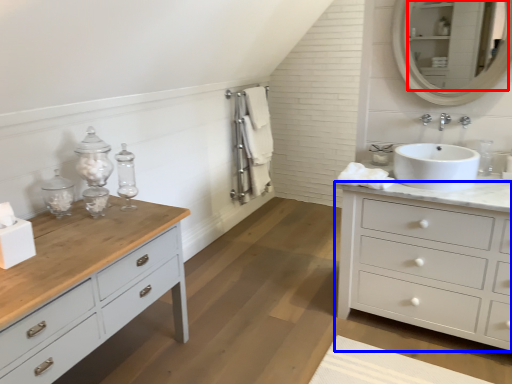
Question: Which object is further to the camera taking this photo, mirror (highlighted by a red box) or chest of drawers (highlighted by a blue box)?

Choices:
 (A) mirror
 (B) chest of drawers

Answer: (A)